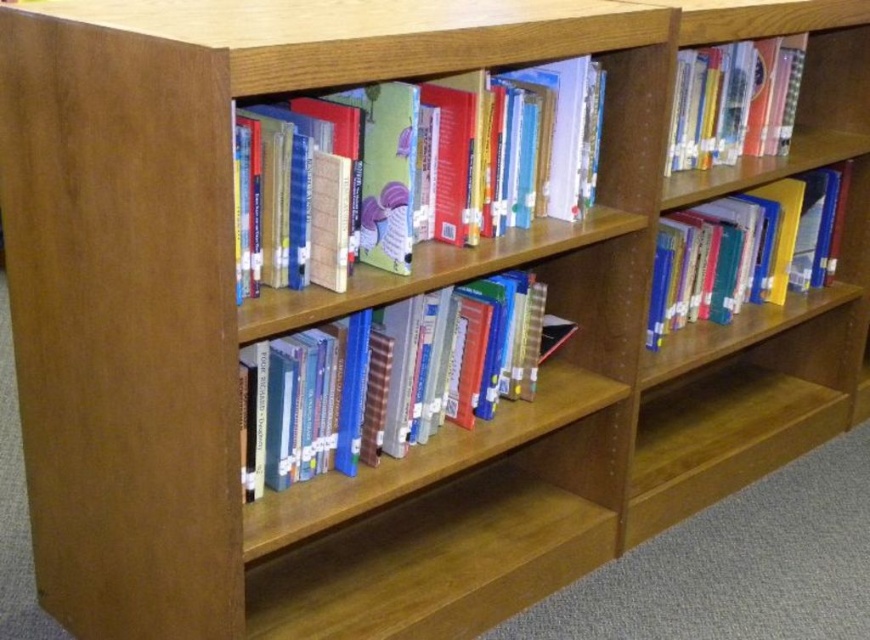
You are standing in front of a wooden bookshelf with books arranged in a somewhat haphazard manner. There is a point at coordinates (x=466, y=202) on the bookshelf. If you want to place a 1.6 meter long ladder against the bookshelf so that the ladder just touches this point, will the ladder be too long to fit in the space available?

The point at coordinates (x=466, y=202) is 1.58 meters from the viewer. Since the ladder is 1.6 meters long, it is slightly longer than the distance to the point. Therefore, the ladder will be too long to fit in the space available and will not reach the point without extending beyond the bookshelf.

You are organizing the books on the wooden bookshelf. You notice the hardcover book at center and the hardcover books at center. Which one is taller?

The hardcover book at center is taller than the hardcover books at center.